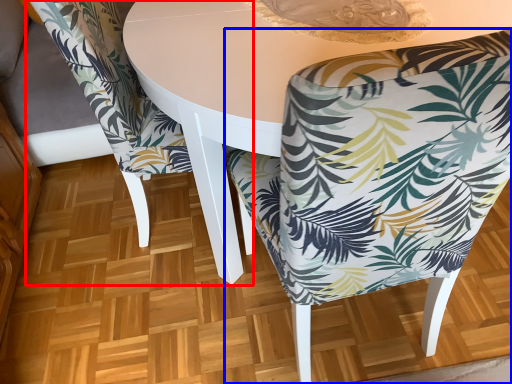
Question: Which object is further to the camera taking this photo, chair (highlighted by a red box) or chair (highlighted by a blue box)?

Choices:
 (A) chair
 (B) chair

Answer: (A)